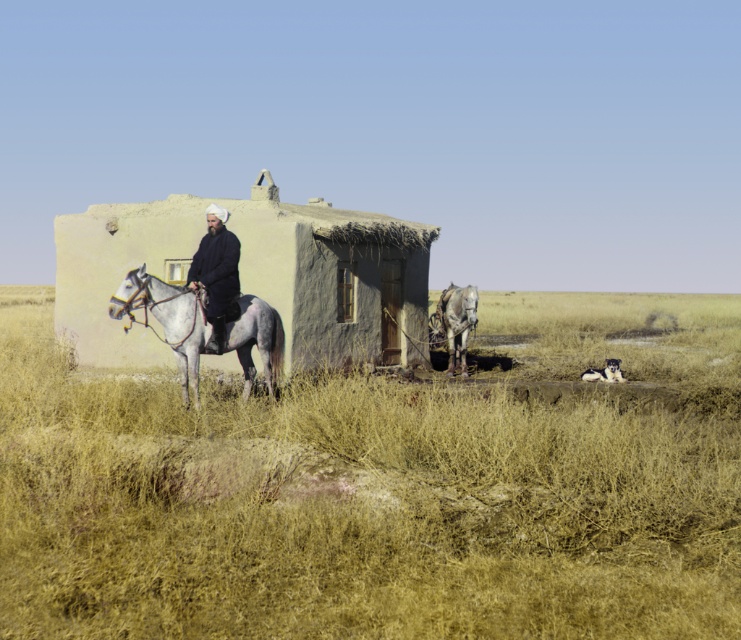
Is dry grass at center thinner than gray matte horse at left?

Incorrect, dry grass at center's width is not less than gray matte horse at left's.

I want to click on dry grass at center, so click(376, 492).

Is dry grass at center positioned at the back of light beige mudbrick hut at center?

No, dry grass at center is in front of light beige mudbrick hut at center.

Between dry grass at center and light beige mudbrick hut at center, which one appears on the left side from the viewer's perspective?

Positioned to the left is dry grass at center.

Which is behind, point (376, 561) or point (64, 337)?

Point (64, 337)

The image size is (741, 640). Identify the location of dry grass at center. (376, 492).

Does dark blue fabric at center appear over gray matte horse at center?

Indeed, dark blue fabric at center is positioned over gray matte horse at center.

Which is more to the right, dark blue fabric at center or gray matte horse at center?

gray matte horse at center

Is point (187, 278) less distant than point (435, 342)?

Yes.

The image size is (741, 640). In order to click on dark blue fabric at center in this screenshot , I will do `click(216, 273)`.